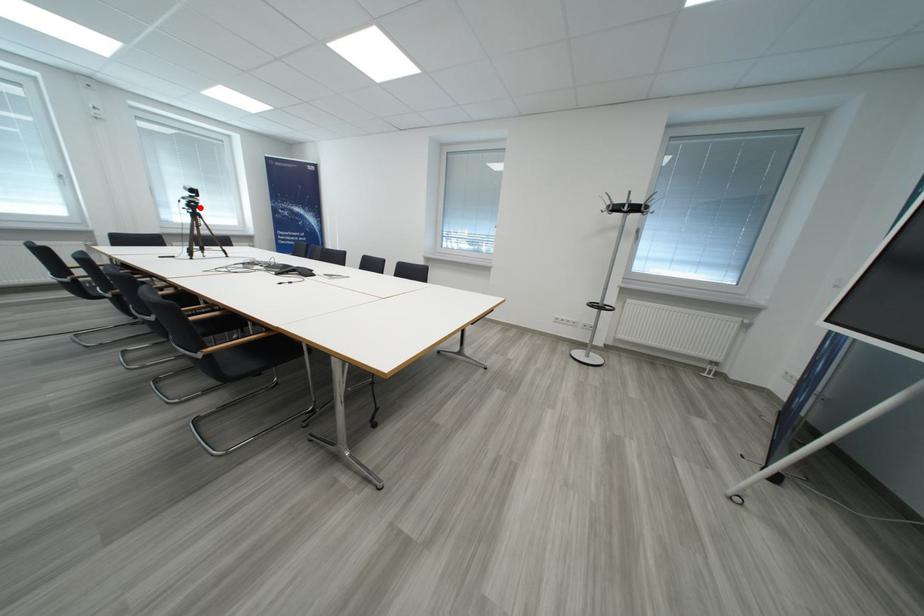
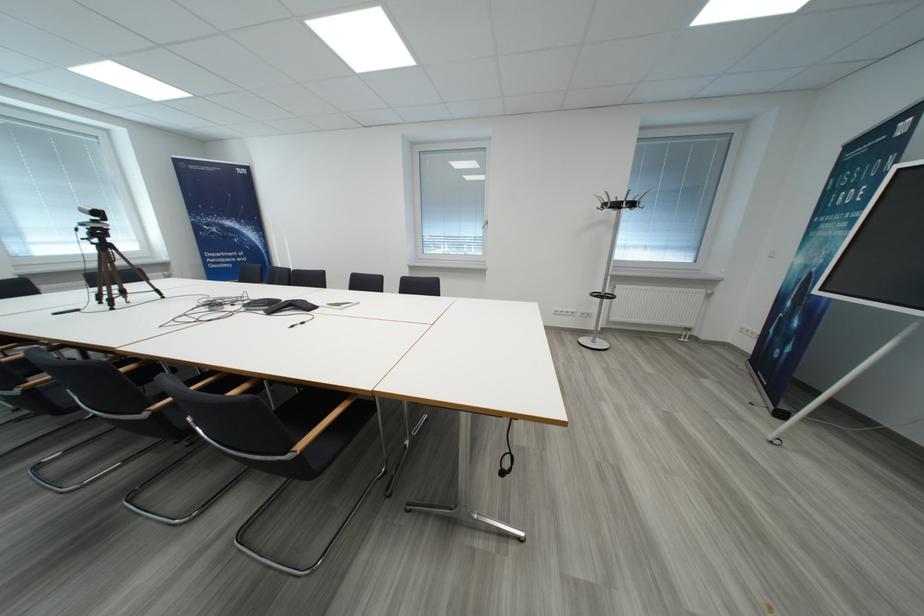
Question: I am providing you with two images of the same scene from different viewpoints. In image1, a red point is highlighted. Considering the same 3D point in image2, which of the following is correct?

Choices:
 (A) It is closer
 (B) It is farther

Answer: (B)